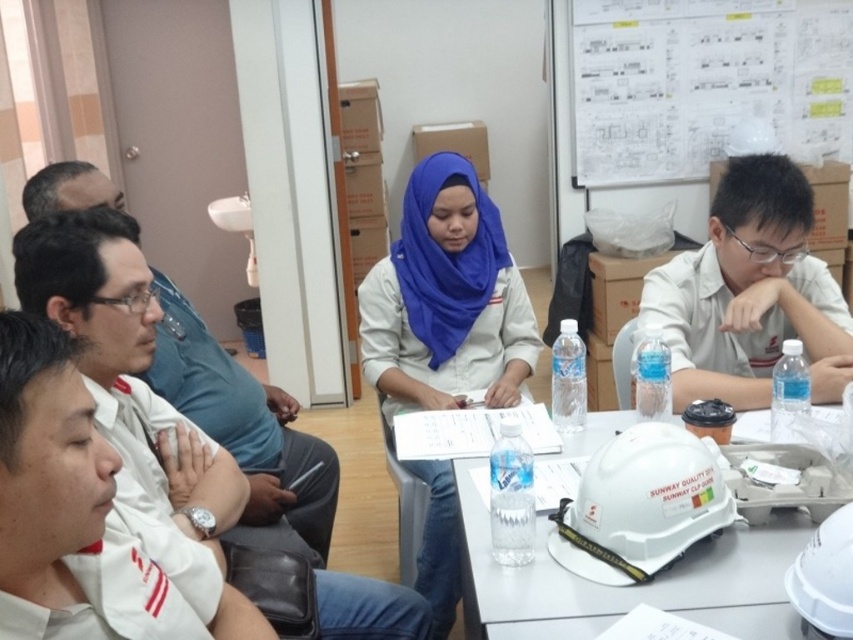
You are a new employee entering the meeting room and see the matte blue hijab at center and the white hard hat at center on the table. Which object is closer to your left side when facing the table?

The matte blue hijab at center is to the left of the white hard hat at center, so when facing the table, the matte blue hijab at center would be closer to your left side.

You are standing at the point labeled as point (595, 618) and want to walk towards the exit door located at point (506, 348). Is the exit door directly in front of you or behind you?

The exit door located at point (506, 348) is behind point (595, 618), so the exit door is behind you.

You are attending a meeting in the room and need to hand a document to the person wearing the matte blue hijab at center and the white hard hat at center. Which one can you reach without moving from your current position?

The matte blue hijab at center is closer to you than the white hard hat at center, so you can reach the person wearing the matte blue hijab at center without moving.